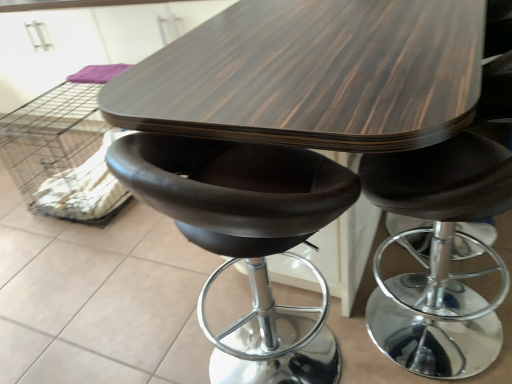
Question: Visually, is matte black stool at center positioned to the left or to the right of white fabric crate at lower left?

Choices:
 (A) right
 (B) left

Answer: (A)

Question: Is matte black stool at center inside the boundaries of white fabric crate at lower left, or outside?

Choices:
 (A) outside
 (B) inside

Answer: (A)

Question: Estimate the real-world distances between objects in this image. Which object is closer to the dark wood table at center?

Choices:
 (A) matte black stool at center
 (B) white fabric crate at lower left

Answer: (A)

Question: Considering the real-world distances, which object is closest to the dark wood table at center?

Choices:
 (A) matte black stool at center
 (B) white fabric crate at lower left

Answer: (A)